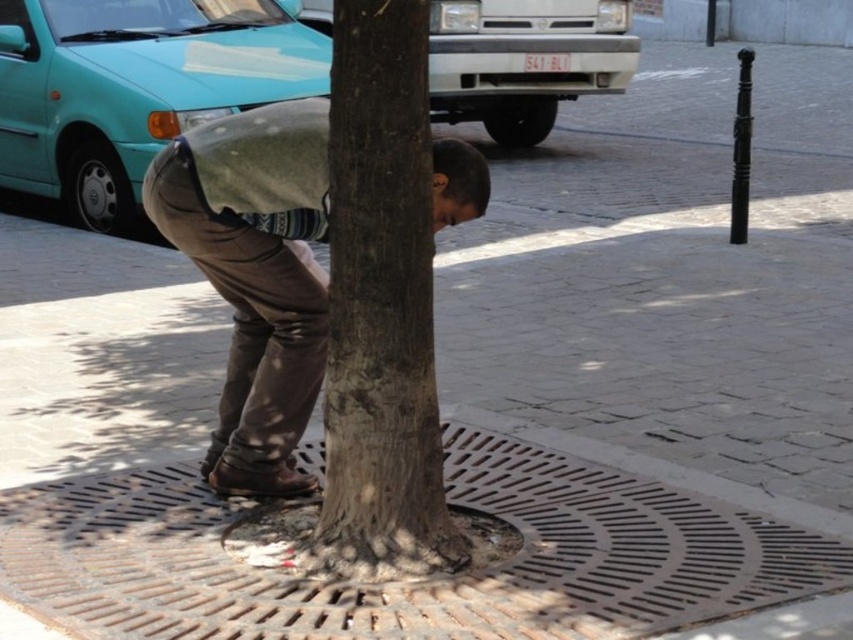
Based on the photo, you are a pedestrian walking on the street and see the brown rough bark at center and the brown leather pants at center. Which object is positioned higher from the ground?

The brown rough bark at center is above the brown leather pants at center, so the brown rough bark at center is positioned higher from the ground.

You are a city inspector checking the urban street scene. You notice the brown rough bark at center and the brown leather pants at center. Which object has a smaller width?

The brown rough bark at center is thinner than the brown leather pants at center, so the brown rough bark at center has a smaller width.